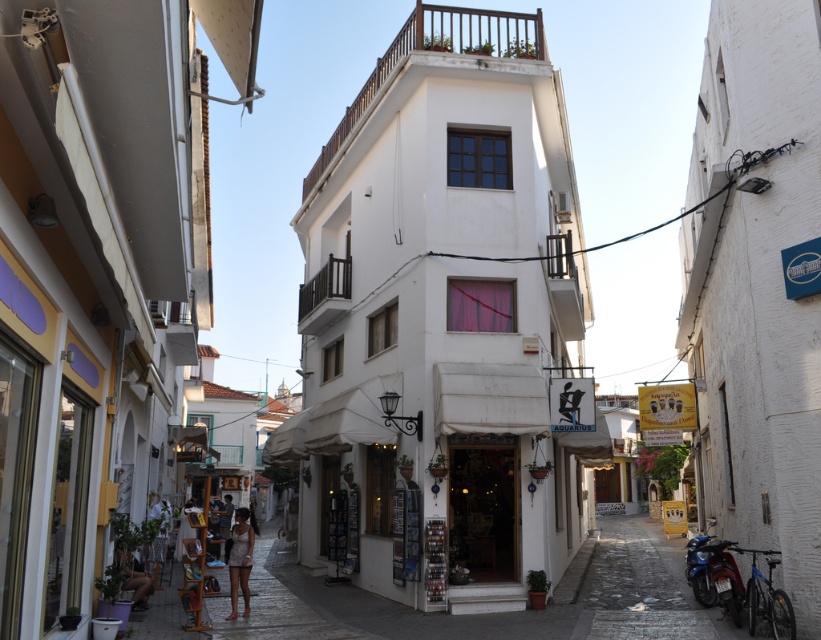
You are a tourist standing in the street and want to visit the shop entrance. Is the point marked by the coordinates point (241, 557) closer to the shop entrance than the woman?

The point marked by the coordinates point (241, 557) is the white textured dress at center, which is located at the center of the image. Since the woman is standing near the entrance, the point is farther from the shop entrance than the woman.

You are a tourist shopping for a dress and see both the white textured dress at center and the white cotton dress at lower left in a shop. Which dress is positioned closer to the right side of the store?

The white textured dress at center is positioned to the right of the white cotton dress at lower left, so it is closer to the right side of the store.